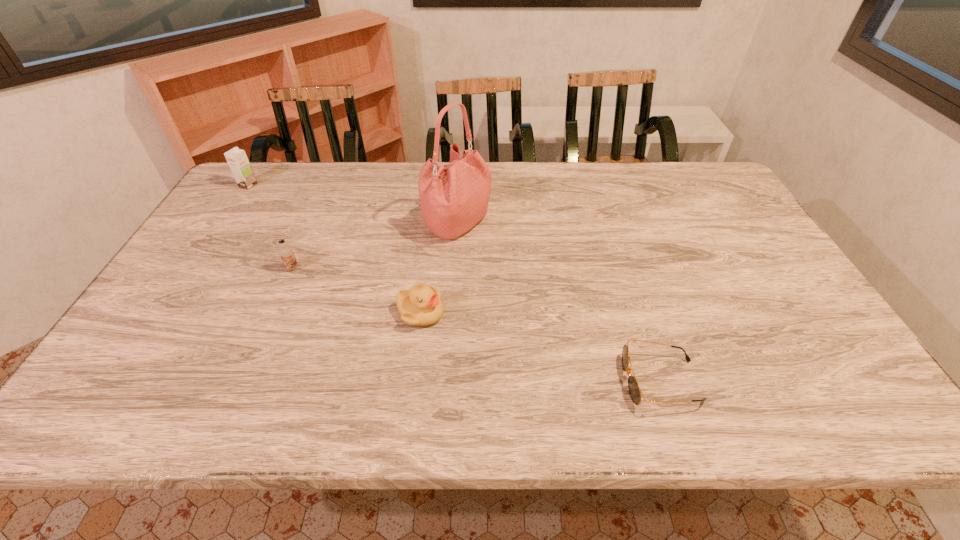
At what (x,y) coordinates should I click in order to perform the action: click on vacant space situated 0.150m on the right of the left chocolate milk. Please return your answer as a coordinate pair (x, y). This screenshot has width=960, height=540. Looking at the image, I should click on (301, 185).

You are a GUI agent. You are given a task and a screenshot of the screen. Output one action in this format:
    pyautogui.click(x=<x>, y=<y>)
    Task: Click on the blank space located on the back of the nearer chocolate milk
    
    Given the screenshot: What is the action you would take?
    pyautogui.click(x=329, y=183)

The image size is (960, 540). Find the location of `free spot located 0.330m on the beak of the duckling`. free spot located 0.330m on the beak of the duckling is located at coordinates (x=578, y=313).

Locate an element on the screen. This screenshot has height=540, width=960. vacant area situated 0.220m on the front-facing side of the nearest object is located at coordinates (522, 381).

Locate an element on the screen. This screenshot has height=540, width=960. free space located 0.120m on the front-facing side of the nearest object is located at coordinates (568, 381).

You are a GUI agent. You are given a task and a screenshot of the screen. Output one action in this format:
    pyautogui.click(x=<x>, y=<y>)
    Task: Click on the vacant position located on the front-facing side of the nearest object
    The height and width of the screenshot is (540, 960).
    Given the screenshot: What is the action you would take?
    pyautogui.click(x=587, y=381)

The image size is (960, 540). I want to click on object that is at the far edge, so click(x=237, y=159).

This screenshot has width=960, height=540. What are the coordinates of `object situated at the near edge` in the screenshot? It's located at (635, 393).

You are a GUI agent. You are given a task and a screenshot of the screen. Output one action in this format:
    pyautogui.click(x=<x>, y=<y>)
    Task: Click on the object located in the left edge section of the desktop
    This screenshot has height=540, width=960.
    Given the screenshot: What is the action you would take?
    pyautogui.click(x=237, y=159)

Identify the location of object located in the far left corner section of the desktop. (237, 159).